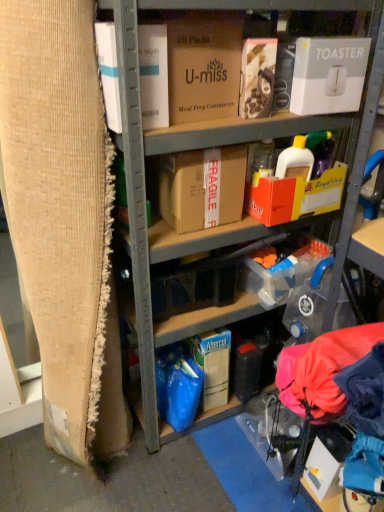
Question: Which direction should I rotate to face brown cardboard box at upper center, which ranks as the 3th box in right-to-left order, — up or down?

Choices:
 (A) up
 (B) down

Answer: (A)

Question: From a real-world perspective, is white cardboard toaster at upper right, acting as the first box starting from the right, on brown cardboard box at center, which appears as the 3th box when viewed from the left?

Choices:
 (A) no
 (B) yes

Answer: (B)

Question: From the image's perspective, is white cardboard toaster at upper right, acting as the first box starting from the right, over brown cardboard box at center, which appears as the 3th box when viewed from the left?

Choices:
 (A) no
 (B) yes

Answer: (B)

Question: Is white cardboard toaster at upper right, the fourth box positioned from the left, taller than brown cardboard box at center, which appears as the 3th box when viewed from the left?

Choices:
 (A) yes
 (B) no

Answer: (B)

Question: Does white cardboard toaster at upper right, acting as the first box starting from the right, have a larger size compared to brown cardboard box at center, arranged as the 2th box when viewed from the right?

Choices:
 (A) no
 (B) yes

Answer: (A)

Question: Is white cardboard toaster at upper right, the fourth box positioned from the left, wider than brown cardboard box at center, arranged as the 2th box when viewed from the right?

Choices:
 (A) no
 (B) yes

Answer: (A)

Question: Does white cardboard toaster at upper right, the fourth box positioned from the left, lie behind brown cardboard box at center, arranged as the 2th box when viewed from the right?

Choices:
 (A) yes
 (B) no

Answer: (B)

Question: Considering the relative positions of brown cardboard at left and white cardboard box at upper left, which is the 4th box from right to left, in the image provided, is brown cardboard at left to the left of white cardboard box at upper left, which is the 4th box from right to left, from the viewer's perspective?

Choices:
 (A) yes
 (B) no

Answer: (A)

Question: From a real-world perspective, is brown cardboard at left on top of white cardboard box at upper left, positioned as the 1th box in left-to-right order?

Choices:
 (A) yes
 (B) no

Answer: (B)

Question: Is brown cardboard at left thinner than white cardboard box at upper left, positioned as the 1th box in left-to-right order?

Choices:
 (A) no
 (B) yes

Answer: (A)

Question: Does brown cardboard at left have a lesser height compared to white cardboard box at upper left, which is the 4th box from right to left?

Choices:
 (A) yes
 (B) no

Answer: (B)

Question: Considering the relative positions of brown cardboard at left and white cardboard box at upper left, positioned as the 1th box in left-to-right order, in the image provided, is brown cardboard at left behind white cardboard box at upper left, positioned as the 1th box in left-to-right order,?

Choices:
 (A) yes
 (B) no

Answer: (B)

Question: Is the position of brown cardboard at left less distant than that of white cardboard box at upper left, which is the 4th box from right to left?

Choices:
 (A) yes
 (B) no

Answer: (A)

Question: Is white cardboard box at upper left, which is the 4th box from right to left, wider than brown cardboard box at center, which appears as the 3th box when viewed from the left?

Choices:
 (A) no
 (B) yes

Answer: (A)